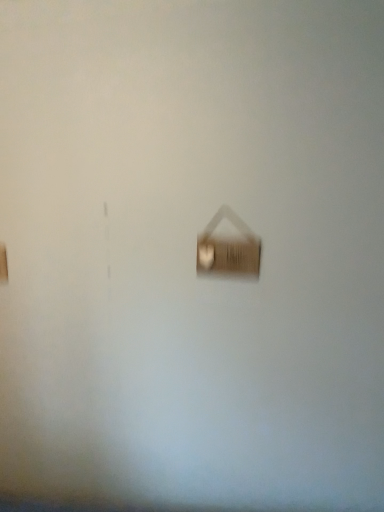
This screenshot has width=384, height=512. I want to click on matte cardboard box at center, so click(x=228, y=249).

Image resolution: width=384 pixels, height=512 pixels. What do you see at coordinates (228, 249) in the screenshot?
I see `matte cardboard box at center` at bounding box center [228, 249].

The width and height of the screenshot is (384, 512). Find the location of `matte cardboard box at center`. matte cardboard box at center is located at coordinates (228, 249).